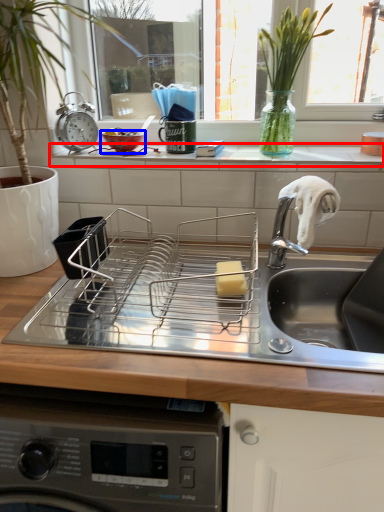
Question: Among these objects, which one is farthest to the camera, window sill (highlighted by a red box) or basin (highlighted by a blue box)?

Choices:
 (A) window sill
 (B) basin

Answer: (B)